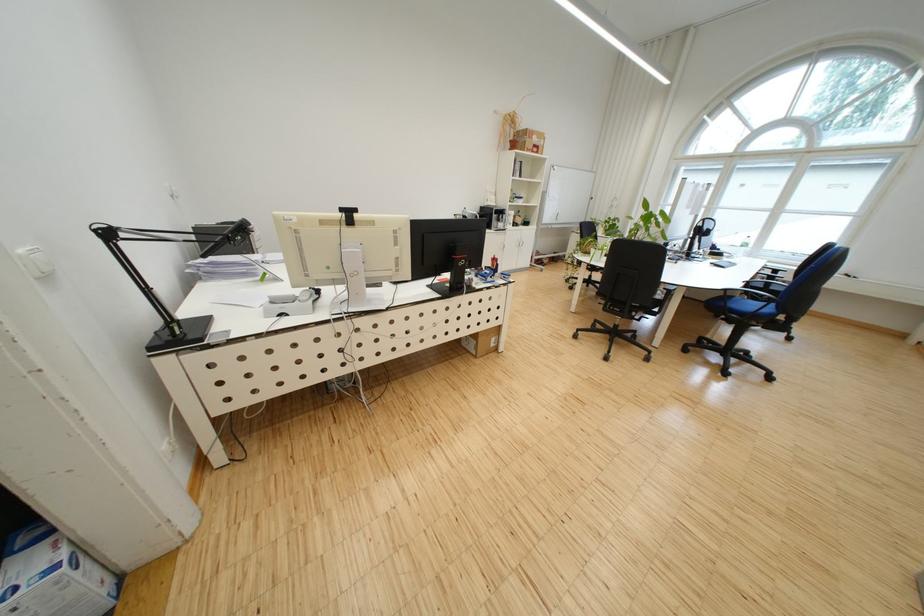
The location [541,462] corresponds to which object?

It refers to a black headset.